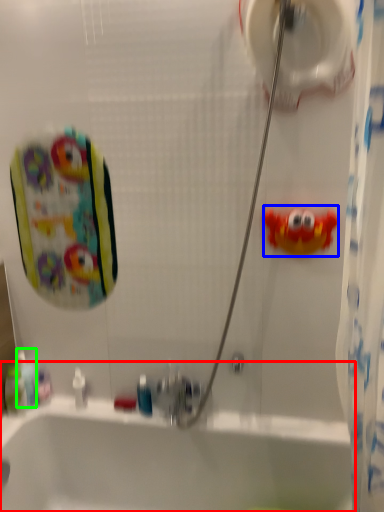
Question: Considering the real-world distances, which object is farthest from bathtub (highlighted by a red box)? toy (highlighted by a blue box) or mouthwash (highlighted by a green box)?

Choices:
 (A) toy
 (B) mouthwash

Answer: (A)